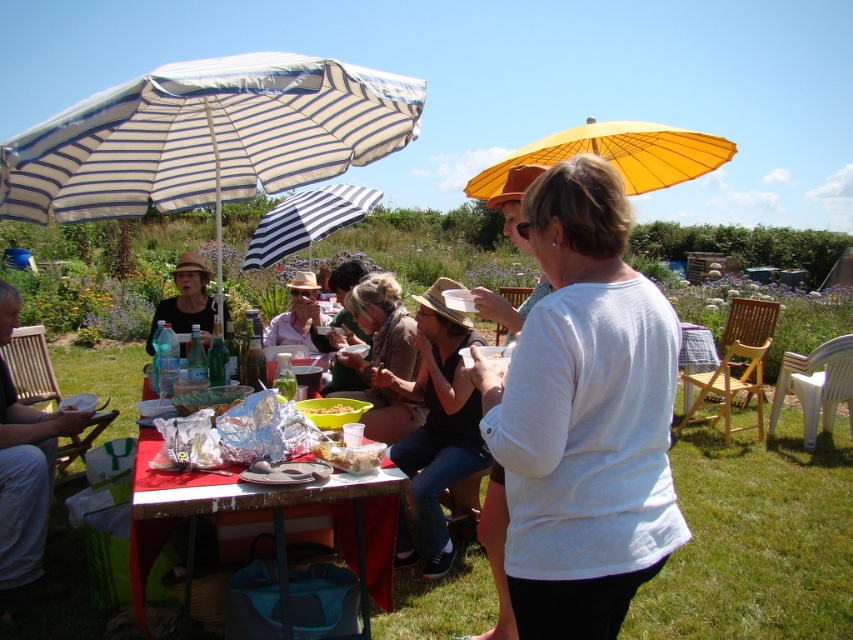
You are a photographer at the gathering and want to take a photo of the blonde hair at center and the yellow plastic bowl at center. Which object should you focus on first to ensure it appears sharp in the photo?

The blonde hair at center is further to the viewer than the yellow plastic bowl at center, so you should focus on the blonde hair at center first to ensure it appears sharp in the photo.

You are organizing a picnic and have a matte straw hat at center and a translucent plastic container at center. Which item can you use to cover the container to keep it cool in the sun?

The matte straw hat at center has a larger size compared to the translucent plastic container at center, so it can be used to cover the container to keep it cool in the sun.